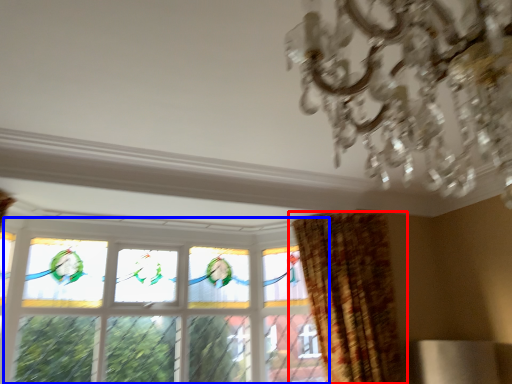
Question: Which object is further to the camera taking this photo, curtain (highlighted by a red box) or window (highlighted by a blue box)?

Choices:
 (A) curtain
 (B) window

Answer: (B)